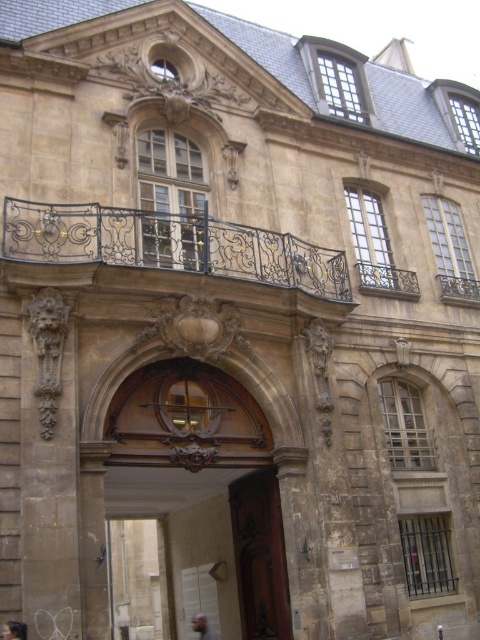
Question: Where is dark brown wrought iron balcony at upper center located in relation to gray hair at center in the image?

Choices:
 (A) above
 (B) below

Answer: (A)

Question: Considering the real-world distances, which object is farthest from the brown polished wood door at center?

Choices:
 (A) dark brown wrought iron balcony at upper center
 (B) gray hair at center

Answer: (A)

Question: Estimate the real-world distances between objects in this image. Which object is closer to the brown polished wood door at center?

Choices:
 (A) gray hair at center
 (B) dark brown hair at lower left

Answer: (A)

Question: Is dark brown wrought iron balcony at upper center positioned in front of brown polished wood door at center?

Choices:
 (A) yes
 (B) no

Answer: (A)

Question: Does dark brown wrought iron balcony at upper center appear under gray hair at center?

Choices:
 (A) no
 (B) yes

Answer: (A)

Question: Which point appears farthest from the camera in this image?

Choices:
 (A) (240, 540)
 (B) (252, 236)

Answer: (A)